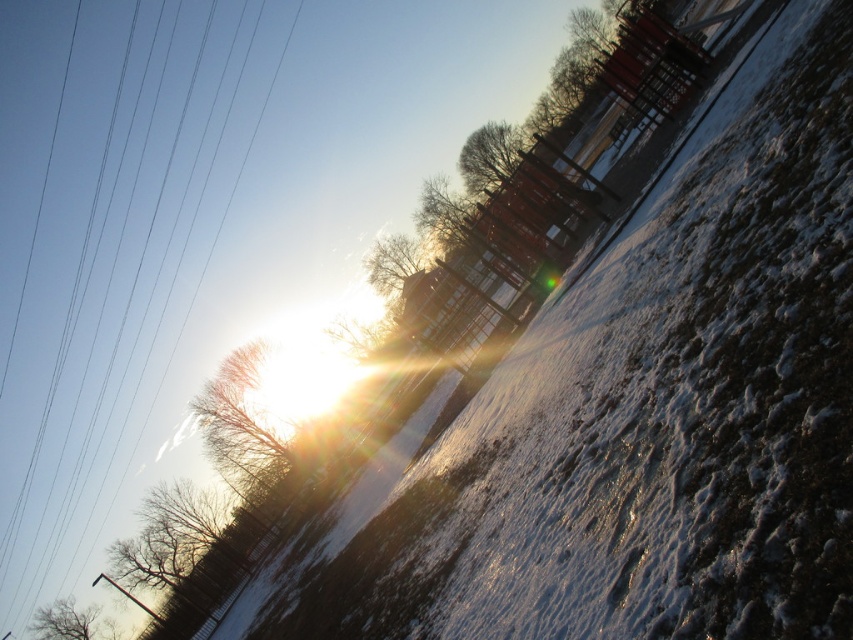
Which is below, brown textured tree at upper left or bare branches at upper center?

brown textured tree at upper left is lower down.

Who is positioned more to the right, brown textured tree at upper left or bare branches at upper center?

From the viewer's perspective, bare branches at upper center appears more on the right side.

Identify the location of brown textured tree at upper left. (242, 426).

Who is higher up, brown textured tree at upper left or brown leafless tree at lower left?

Positioned higher is brown textured tree at upper left.

Identify the location of brown textured tree at upper left. (242, 426).

Which is more to the left, bare brown tree at upper center or bare branches at upper center?

From the viewer's perspective, bare branches at upper center appears more on the left side.

How far apart are bare brown tree at upper center and bare branches at upper center?

The distance of bare brown tree at upper center from bare branches at upper center is 14.58 meters.

The width and height of the screenshot is (853, 640). Find the location of `bare brown tree at upper center`. bare brown tree at upper center is located at coordinates (488, 156).

Locate an element on the screen. bare brown tree at upper center is located at coordinates (488, 156).